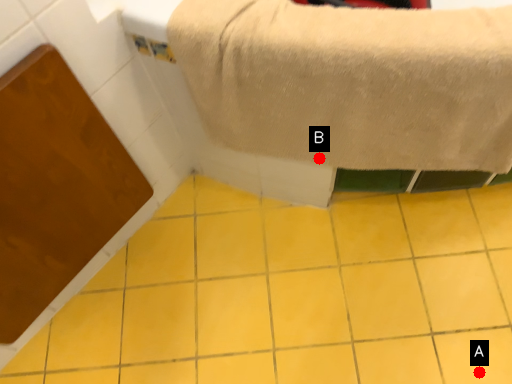
Question: Two points are circled on the image, labeled by A and B beside each circle. Which of the following is the closest to the observer?

Choices:
 (A) A is closer
 (B) B is closer

Answer: (B)